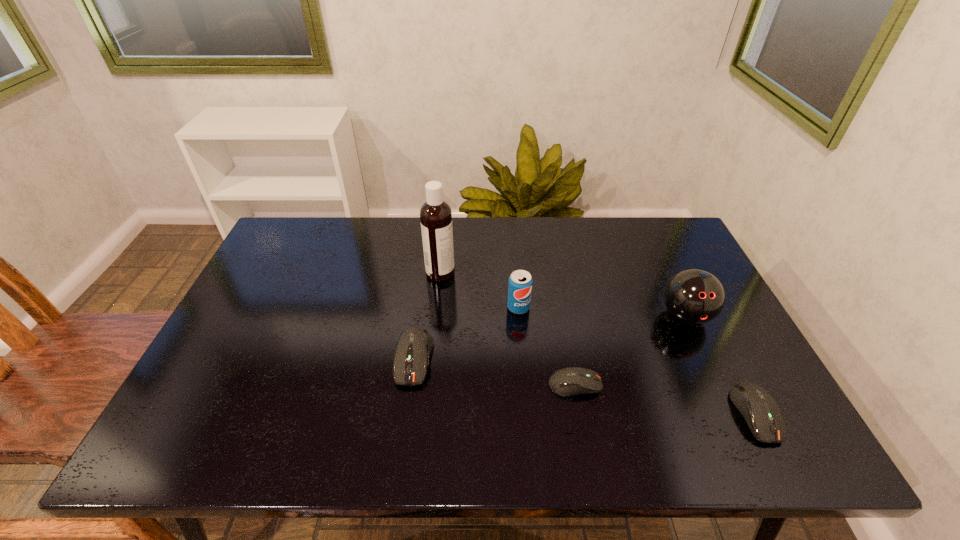
Image resolution: width=960 pixels, height=540 pixels. Find the location of `free region located on the button of the leftmost computer equipment`. free region located on the button of the leftmost computer equipment is located at coordinates (405, 415).

Find the location of a particular element. The height and width of the screenshot is (540, 960). free spot located 0.240m on the button of the shortest object is located at coordinates [x=703, y=384].

Locate an element on the screen. free region located on the front of the fourth shortest object is located at coordinates (528, 414).

The width and height of the screenshot is (960, 540). In order to click on vacant space located on the label side of the dishwasher detergent in this screenshot , I will do `click(553, 273)`.

Where is `free point located 0.090m on the surface of the fifth shortest object near the finger holes`? free point located 0.090m on the surface of the fifth shortest object near the finger holes is located at coordinates (708, 364).

You are a GUI agent. You are given a task and a screenshot of the screen. Output one action in this format:
    pyautogui.click(x=<x>, y=<y>)
    Task: Click on the computer equipment at the right edge
    This screenshot has height=540, width=960.
    Given the screenshot: What is the action you would take?
    pyautogui.click(x=759, y=409)

Locate an element on the screen. bowling ball that is at the right edge is located at coordinates (693, 296).

This screenshot has height=540, width=960. What are the coordinates of `object at the near right corner` in the screenshot? It's located at (759, 409).

What are the coordinates of `free space at the far edge` in the screenshot? It's located at (473, 230).

In the image, there is a desktop. Where is `free space at the near edge`? Image resolution: width=960 pixels, height=540 pixels. free space at the near edge is located at coordinates (268, 383).